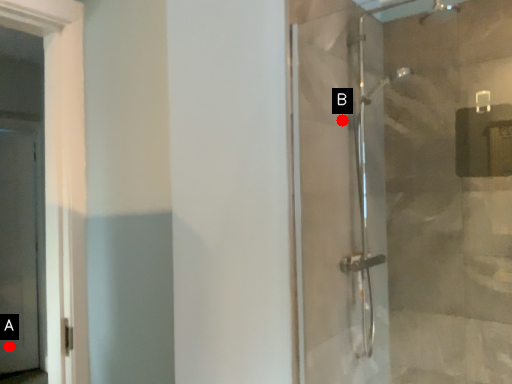
Question: Two points are circled on the image, labeled by A and B beside each circle. Which point is farther from the camera taking this photo?

Choices:
 (A) A is further
 (B) B is further

Answer: (A)